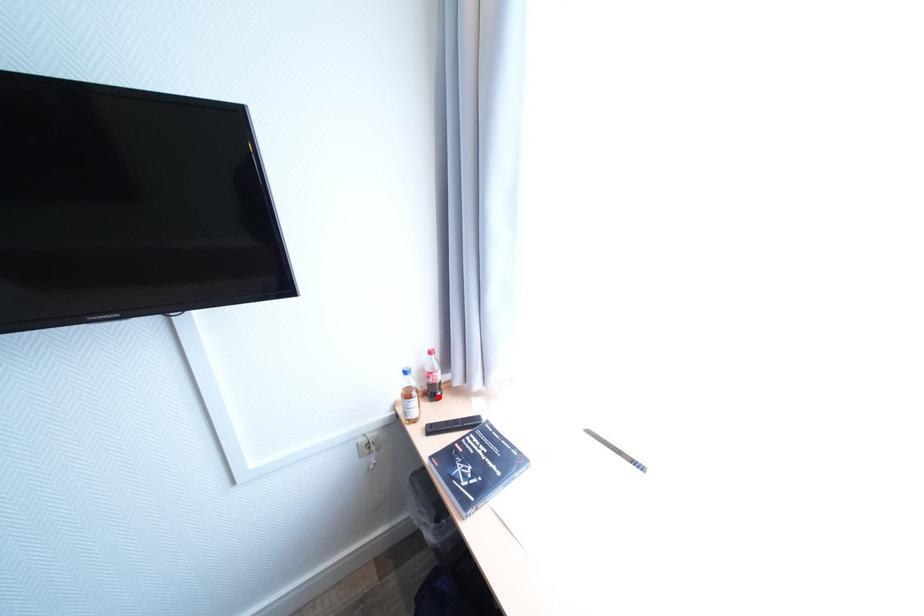
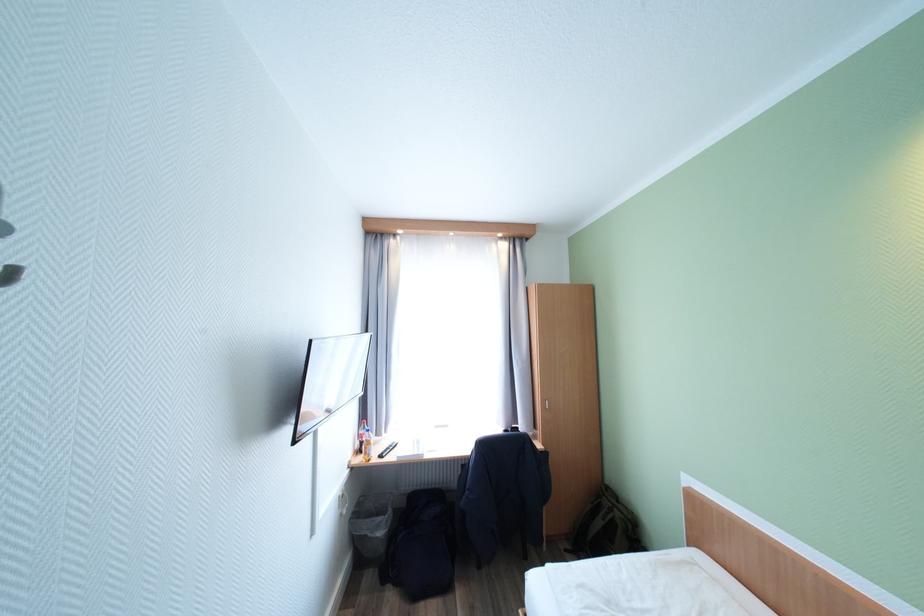
Question: I am providing you with two images of the same scene from different viewpoints. A red point is marked on the first image. Is the red point's position out of view in image 2?

Choices:
 (A) Yes
 (B) No

Answer: (A)